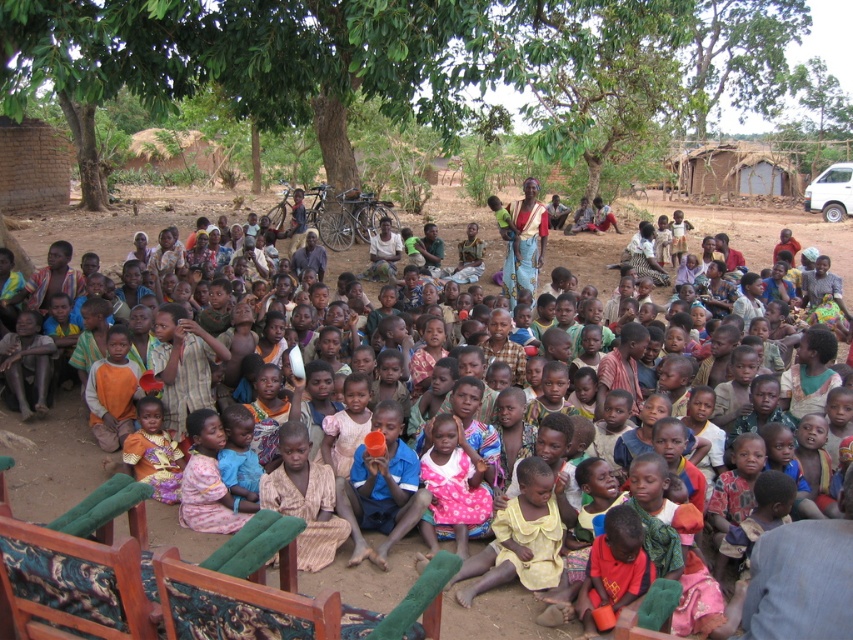
Question: Which point appears closest to the camera in this image?

Choices:
 (A) (102, 96)
 (B) (32, 237)

Answer: (A)

Question: In this image, where is green leafy tree at center located relative to multicolored fabric dress at center?

Choices:
 (A) right
 (B) left

Answer: (B)

Question: Is green leafy tree at center to the left of multicolored fabric dress at center from the viewer's perspective?

Choices:
 (A) yes
 (B) no

Answer: (A)

Question: Which object is farther from the camera taking this photo?

Choices:
 (A) green leafy tree at center
 (B) multicolored fabric dress at center

Answer: (A)

Question: Is green leafy tree at center bigger than multicolored fabric dress at center?

Choices:
 (A) no
 (B) yes

Answer: (B)